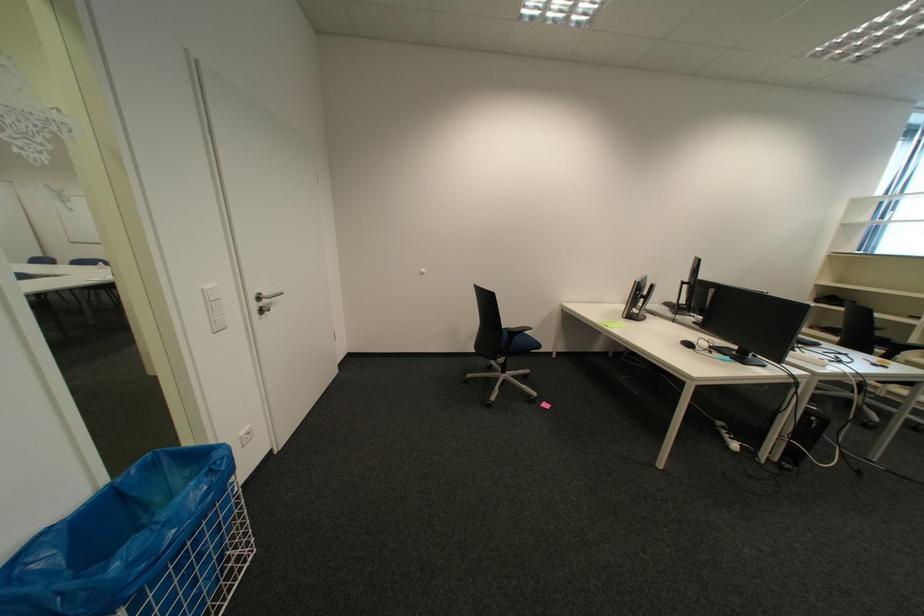
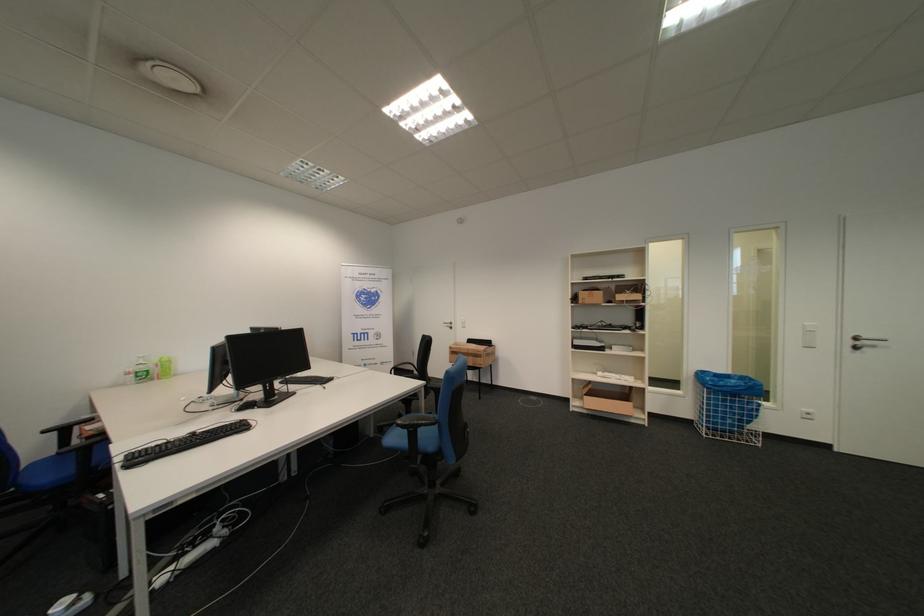
The point at (266, 307) is marked in the first image. Where is the corresponding point in the second image?

(862, 344)